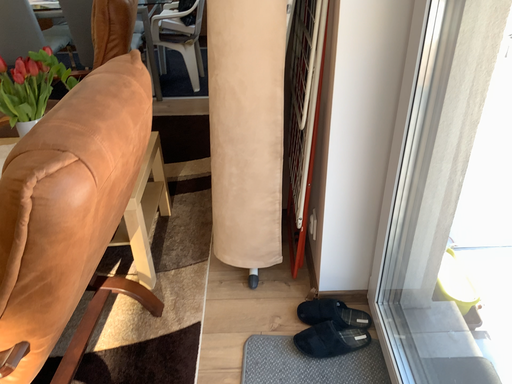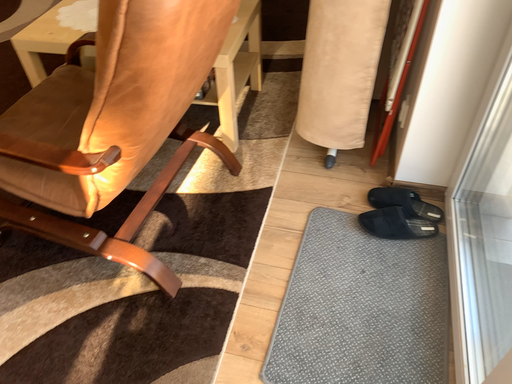
Question: Which way did the camera rotate in the video?

Choices:
 (A) rotated upward
 (B) rotated downward

Answer: (B)